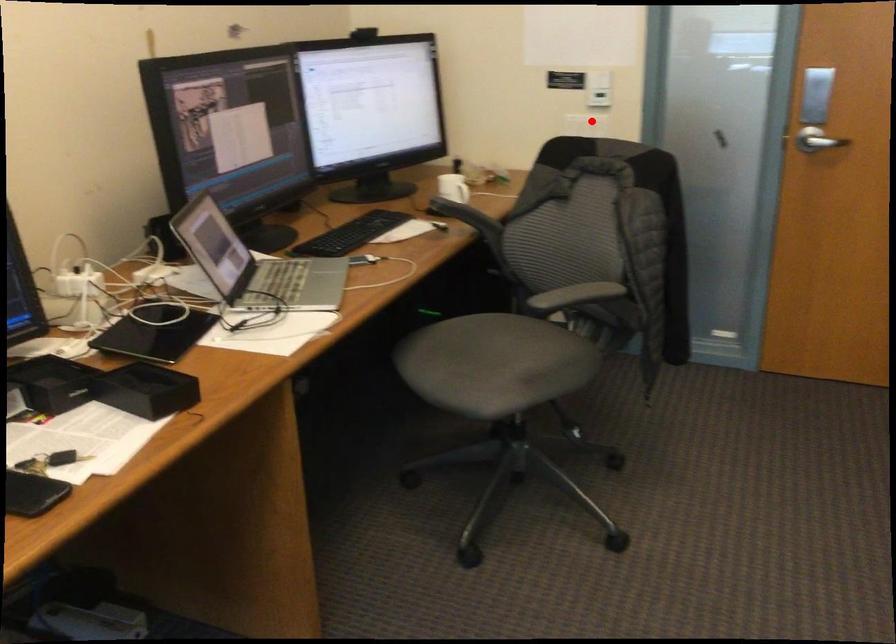
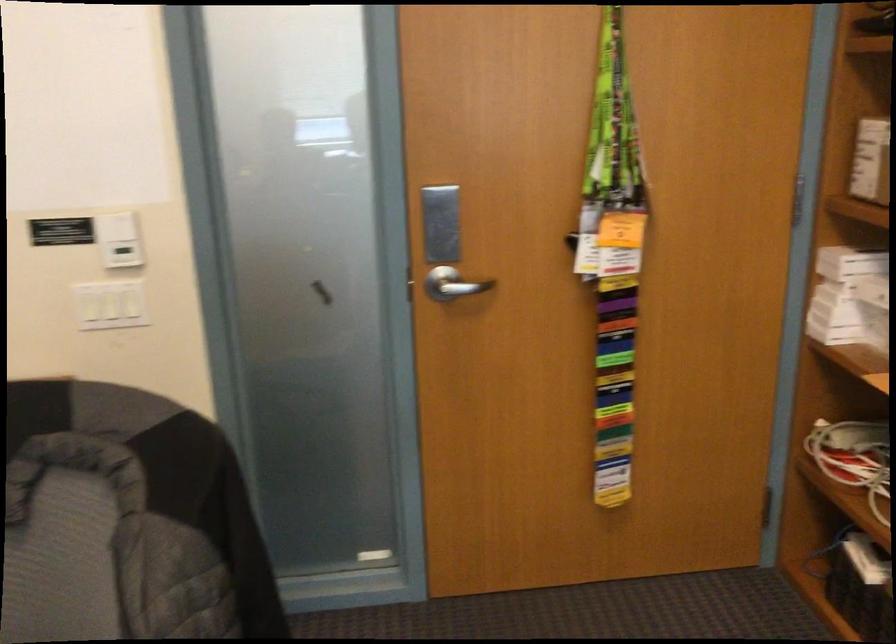
Question: I am providing you with two images of the same scene from different viewpoints. A red point is shown in image1. For the corresponding object point in image2, is it positioned nearer or farther from the camera?

Choices:
 (A) Nearer
 (B) Farther

Answer: (A)